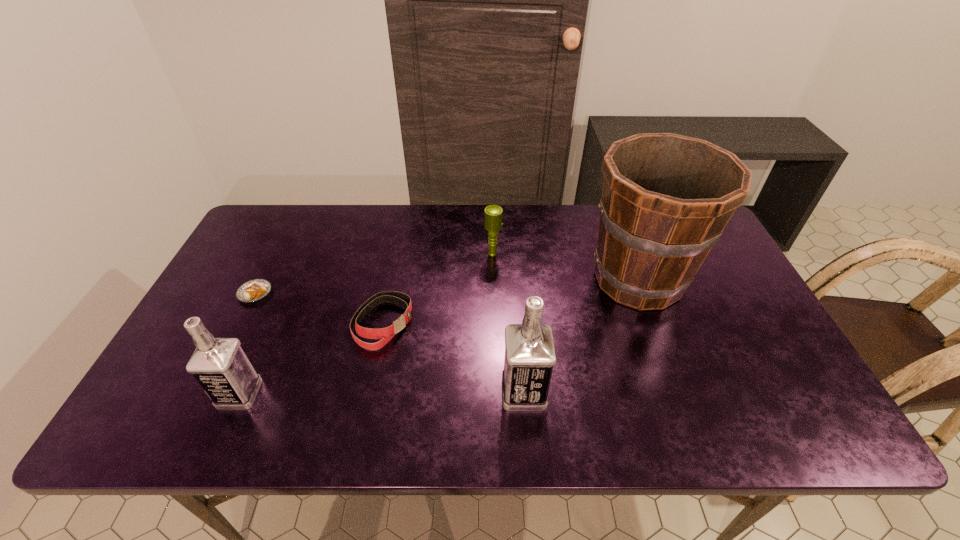
Where is `free space between the rightmost object and the left vodka`? free space between the rightmost object and the left vodka is located at coordinates (439, 336).

Find the location of a particular element. The height and width of the screenshot is (540, 960). vacant area that lies between the fourth tallest object and the left vodka is located at coordinates (367, 323).

At what (x,y) coordinates should I click in order to perform the action: click on unoccupied position between the microphone and the fourth object from right to left. Please return your answer as a coordinate pair (x, y). Looking at the image, I should click on (438, 289).

The width and height of the screenshot is (960, 540). I want to click on vacant area that lies between the taller vodka and the left vodka, so click(x=382, y=393).

The width and height of the screenshot is (960, 540). Find the location of `free spot between the second tallest object and the tallest object`. free spot between the second tallest object and the tallest object is located at coordinates (581, 335).

At what (x,y) coordinates should I click in order to perform the action: click on vacant area between the shortest object and the rightmost object. Please return your answer as a coordinate pair (x, y). The image size is (960, 540). Looking at the image, I should click on (446, 286).

Image resolution: width=960 pixels, height=540 pixels. Find the location of `free area in between the left vodka and the second tallest object`. free area in between the left vodka and the second tallest object is located at coordinates (x=382, y=393).

Find the location of a particular element. free spot between the second tallest object and the fifth tallest object is located at coordinates (453, 358).

Locate which object ranks fourth in proximity to the rightmost object. Please provide its 2D coordinates. Your answer should be formatted as a tuple, i.e. [(x, y)], where the tuple contains the x and y coordinates of a point satisfying the conditions above.

[(220, 366)]

This screenshot has width=960, height=540. In order to click on object that stands as the second closest to the pastry in this screenshot , I will do `click(385, 334)`.